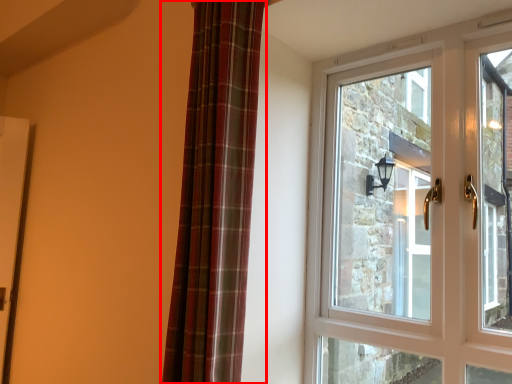
Question: Where is curtain (annotated by the red box) located in relation to window in the image?

Choices:
 (A) left
 (B) right

Answer: (A)